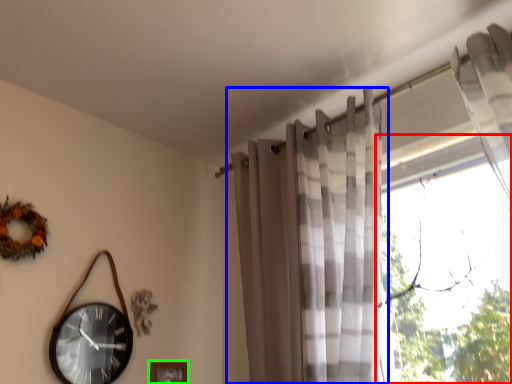
Question: Considering the real-world distances, which object is farthest from window (highlighted by a red box)? curtain (highlighted by a blue box) or picture frame (highlighted by a green box)?

Choices:
 (A) curtain
 (B) picture frame

Answer: (B)